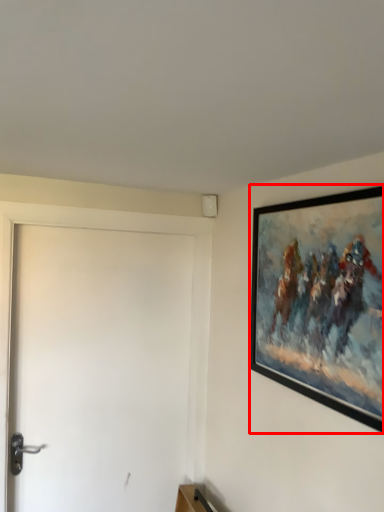
Question: In this image, where is picture frame (annotated by the red box) located relative to door?

Choices:
 (A) right
 (B) left

Answer: (A)